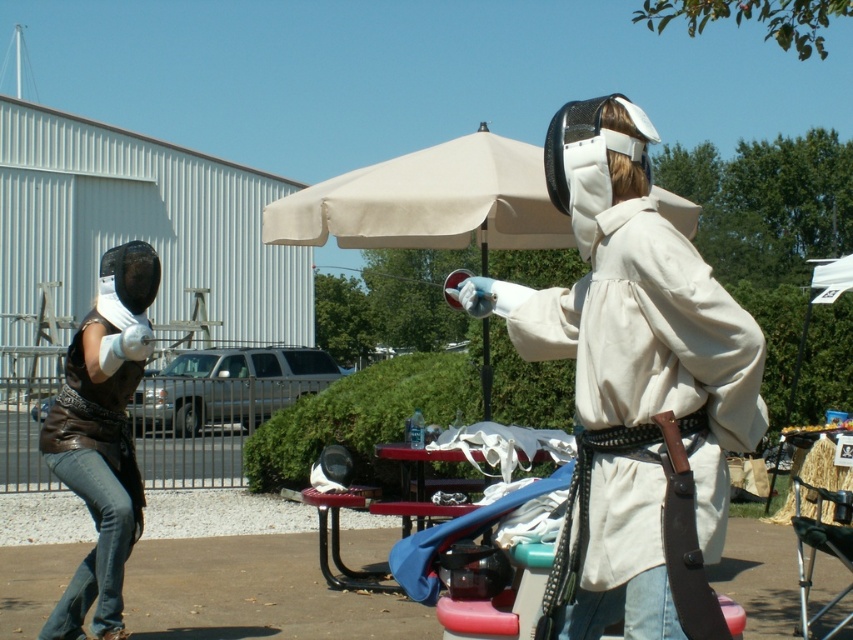
Question: In this image, where is white matte fencing mask at center located relative to brown leather vest at left?

Choices:
 (A) left
 (B) right

Answer: (B)

Question: Which object is farther from the camera taking this photo?

Choices:
 (A) white matte fencing mask at center
 (B) beige fabric umbrella at center
 (C) brown leather vest at left

Answer: (B)

Question: Considering the relative positions of white matte fencing mask at center and beige fabric umbrella at center in the image provided, where is white matte fencing mask at center located with respect to beige fabric umbrella at center?

Choices:
 (A) left
 (B) right

Answer: (B)

Question: Estimate the real-world distances between objects in this image. Which object is farther from the beige fabric umbrella at center?

Choices:
 (A) brown leather vest at left
 (B) white matte fencing mask at center

Answer: (B)

Question: Does beige fabric umbrella at center have a greater width compared to brown leather vest at left?

Choices:
 (A) yes
 (B) no

Answer: (A)

Question: Considering the real-world distances, which object is closest to the white matte fencing mask at center?

Choices:
 (A) beige fabric umbrella at center
 (B) brown leather vest at left

Answer: (B)